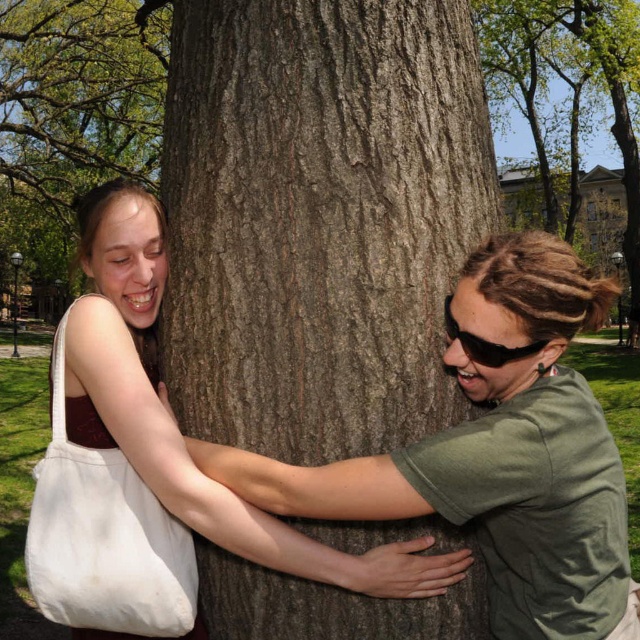
Question: Does brown rough tree trunk at center have a smaller size compared to smooth brown bark at center?

Choices:
 (A) no
 (B) yes

Answer: (B)

Question: Which point appears closest to the camera in this image?

Choices:
 (A) (464, 348)
 (B) (433, 54)
 (C) (4, 90)
 (D) (586, 54)

Answer: (A)

Question: Based on their relative distances, which object is nearer to the white canvas tote at left?

Choices:
 (A) black plastic goggles at right
 (B) brown rough tree trunk at center
 (C) smooth bark tree at center
 (D) smooth brown bark at center

Answer: (B)

Question: Is brown rough tree trunk at center wider than smooth bark tree at center?

Choices:
 (A) yes
 (B) no

Answer: (B)

Question: Does smooth bark tree at center appear over white canvas tote at left?

Choices:
 (A) yes
 (B) no

Answer: (A)

Question: Which of the following is the farthest from the observer?

Choices:
 (A) (544, 342)
 (B) (147, 129)
 (C) (304, 116)

Answer: (B)